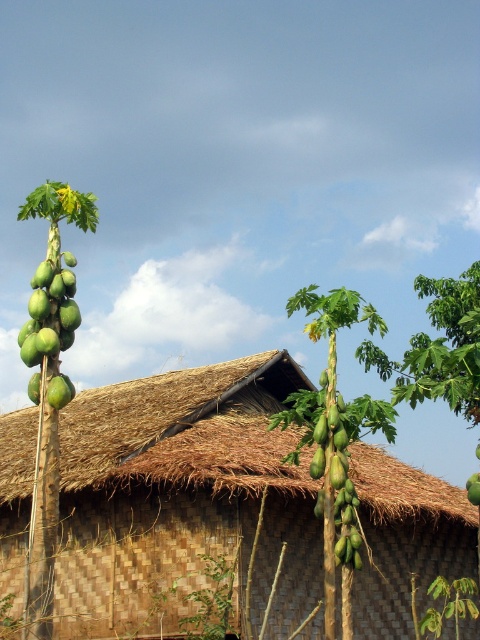
You are standing in front of the thatched roof structure and want to pick a papaya from the green papaya tree at left. Considering your height is 1.7 meters, can you reach the nearest papaya on the tree without any tools?

The green papaya tree at left is 11.66 meters away from you. Since the distance is too far, you cannot reach the nearest papaya on the tree without any tools.

You are standing in front of the thatched roof structure and see the green papaya tree at left and the green papaya at center. Which object is positioned higher relative to the other?

The green papaya tree at left is located above the green papaya at center, so it is positioned higher.

You are standing in front of the traditional thatched roof structure and see the green papaya tree at left and the green matte papaya at left. Which object is taller?

The green papaya tree at left is taller than the green matte papaya at left.